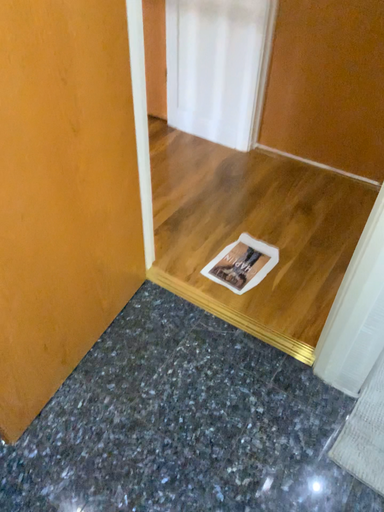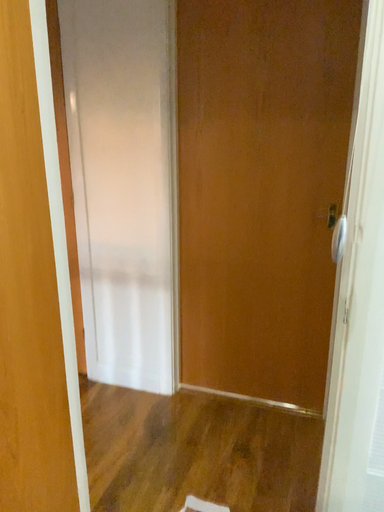
Question: Which way did the camera rotate in the video?

Choices:
 (A) rotated right
 (B) rotated left

Answer: (A)